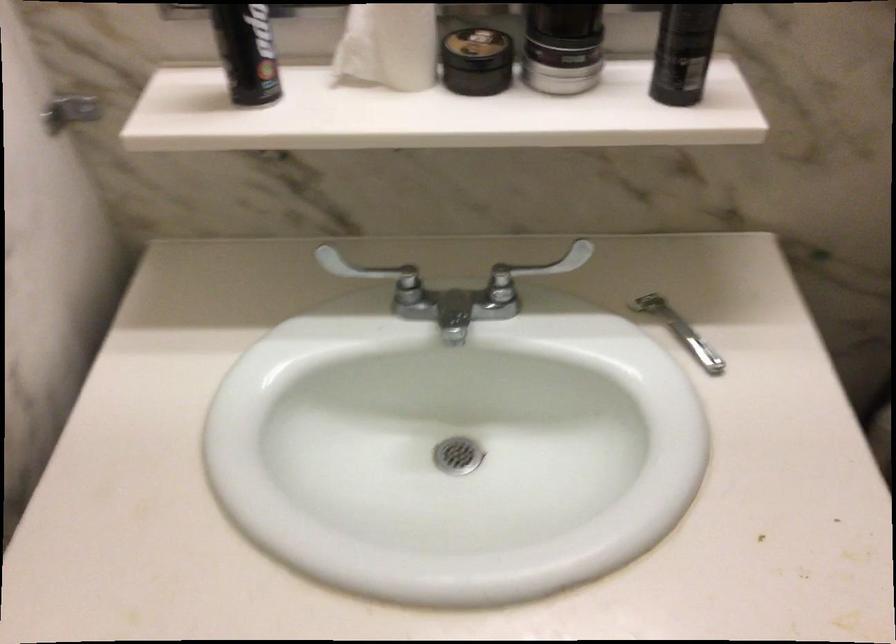
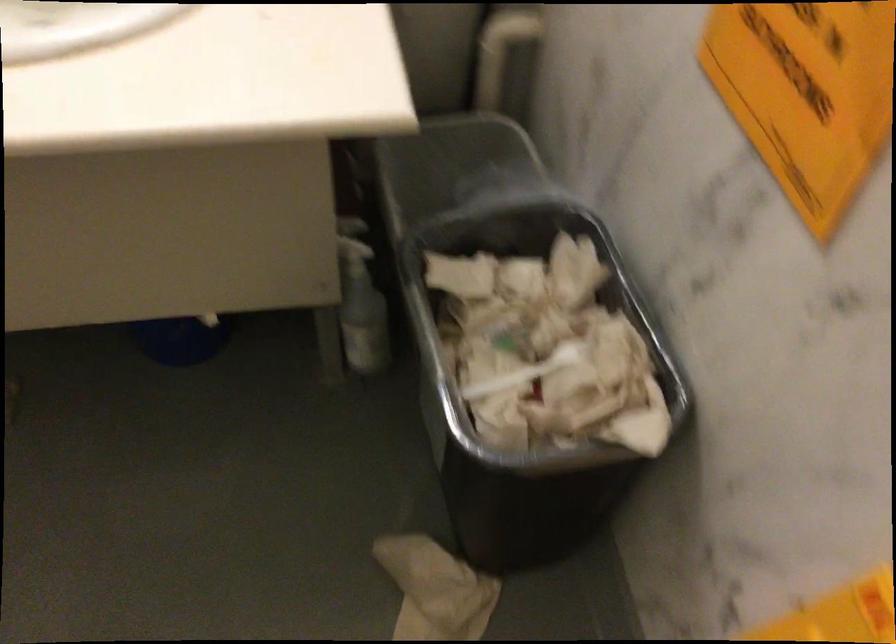
What movement of the cameraman would produce the second image?

The movement direction of the cameraman is right, backward.